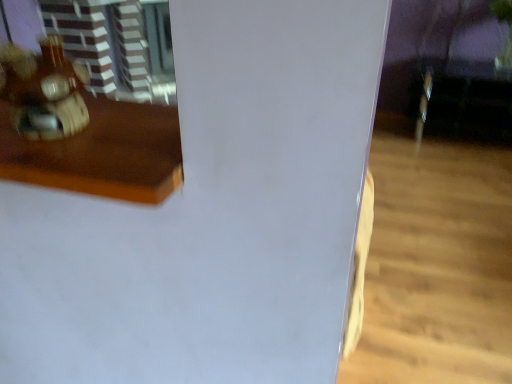
Where is `wooden table at left`? The height and width of the screenshot is (384, 512). wooden table at left is located at coordinates click(x=102, y=153).

This screenshot has height=384, width=512. Describe the element at coordinates (102, 153) in the screenshot. I see `wooden table at left` at that location.

Where is `wooden toy at left`? This screenshot has height=384, width=512. wooden toy at left is located at coordinates (42, 90).

Describe the element at coordinates (42, 90) in the screenshot. I see `wooden toy at left` at that location.

In order to face wooden toy at left, should I rotate leftwards or rightwards?

You should rotate left by 27.431 degrees.

Locate an element on the screen. The image size is (512, 384). wooden table at left is located at coordinates (102, 153).

Considering the relative positions of wooden toy at left and wooden table at left in the image provided, is wooden toy at left to the left or to the right of wooden table at left?

wooden toy at left is to the left of wooden table at left.

In the scene shown: Which object is closer to the camera, wooden toy at left or wooden table at left?

wooden table at left.

Does point (48, 121) lie behind point (98, 107)?

No.

From the image's perspective, which is above, wooden toy at left or wooden table at left?

From the image's view, wooden toy at left is above.

From a real-world perspective, is wooden toy at left beneath wooden table at left?

Actually, wooden toy at left is physically above wooden table at left in the real world.

Between wooden toy at left and wooden table at left, which one has larger width?

With larger width is wooden table at left.

Does wooden toy at left have a lesser height compared to wooden table at left?

No, wooden toy at left is not shorter than wooden table at left.

Looking at this image, is wooden toy at left smaller than wooden table at left?

Indeed, wooden toy at left has a smaller size compared to wooden table at left.

Based on the photo, which is correct: wooden toy at left is inside wooden table at left, or outside of it?

wooden toy at left exists outside the volume of wooden table at left.

Would you say wooden toy at left is a long distance from wooden table at left?

They are positioned close to each other.

Is wooden toy at left facing towards wooden table at left?

No, wooden toy at left is not facing towards wooden table at left.

At what (x,y) coordinates should I click in order to perform the action: click on furniture that appears on the right of wooden toy at left. Please return your answer as a coordinate pair (x, y). Image resolution: width=512 pixels, height=384 pixels. Looking at the image, I should click on (102, 153).

Which is more to the right, wooden table at left or wooden toy at left?

Positioned to the right is wooden table at left.

Based on the photo, who is more distant, wooden table at left or wooden toy at left?

wooden toy at left.

Between point (152, 180) and point (37, 91), which one is positioned in front?

The point (152, 180) is closer.

From the image's perspective, relative to wooden toy at left, is wooden table at left above or below?

Based on their image positions, wooden table at left is located beneath wooden toy at left.

In the scene shown: From a real-world perspective, is wooden table at left positioned over wooden toy at left based on gravity?

No, from a real-world perspective, wooden table at left is not over wooden toy at left

Considering the relative sizes of wooden table at left and wooden toy at left in the image provided, is wooden table at left thinner than wooden toy at left?

No.

Based on the photo, between wooden table at left and wooden toy at left, which one has less height?

wooden table at left is shorter.

Is wooden table at left bigger or smaller than wooden toy at left?

wooden table at left is bigger than wooden toy at left.

Is wooden table at left completely or partially outside of wooden toy at left?

That's correct, wooden table at left is outside of wooden toy at left.

Would you say wooden table at left is a long distance from wooden toy at left?

wooden table at left is near wooden toy at left, not far away.

Is wooden table at left turned away from wooden toy at left?

No, wooden table at left's orientation is not away from wooden toy at left.

What's the angular difference between wooden table at left and wooden toy at left's facing directions?

There is a 0.00101-degree angle between the facing directions of wooden table at left and wooden toy at left.

Locate an element on the screen. Image resolution: width=512 pixels, height=384 pixels. furniture that appears below the wooden toy at left (from a real-world perspective) is located at coordinates (102, 153).

Identify the location of furniture below the wooden toy at left (from a real-world perspective). This screenshot has width=512, height=384. (102, 153).

Locate an element on the screen. toy on the left of the wooden table at left is located at coordinates (42, 90).